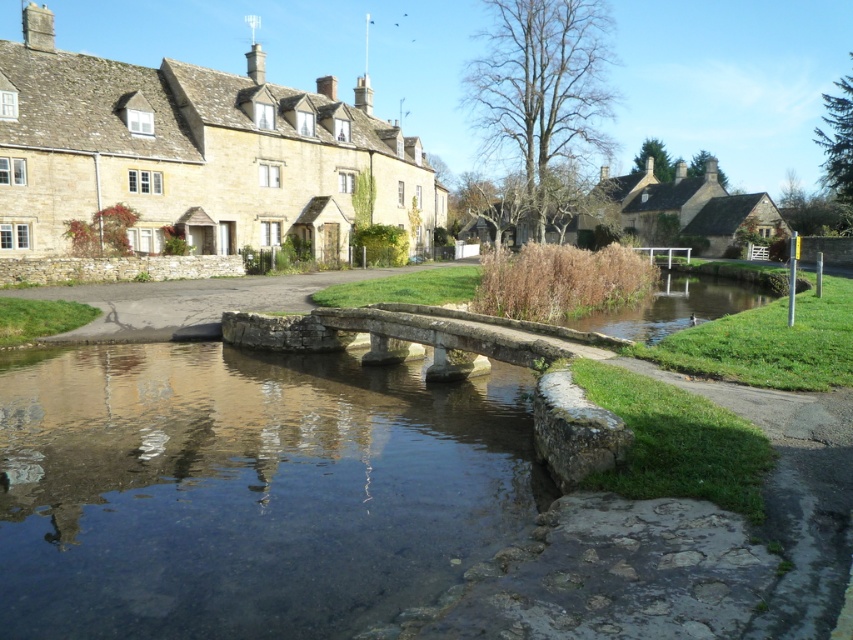
I want to click on clear stone water at center, so click(247, 490).

Who is more distant from viewer, (155, 540) or (160, 128)?

The point (160, 128) is behind.

Between point (242, 406) and point (383, 170), which one is positioned in front?

Positioned in front is point (242, 406).

Identify the location of clear stone water at center. The image size is (853, 640). (247, 490).

Is stone village at upper left behind matte stone house at center?

No, it is not.

Does stone village at upper left appear on the left side of matte stone house at center?

Yes, stone village at upper left is to the left of matte stone house at center.

Between point (15, 173) and point (624, 205), which one is positioned in front?

Point (15, 173)

Identify the location of stone village at upper left. (196, 156).

Where is `clear stone water at center`? clear stone water at center is located at coordinates click(x=247, y=490).

What do you see at coordinates (247, 490) in the screenshot? I see `clear stone water at center` at bounding box center [247, 490].

This screenshot has width=853, height=640. Identify the location of clear stone water at center. (247, 490).